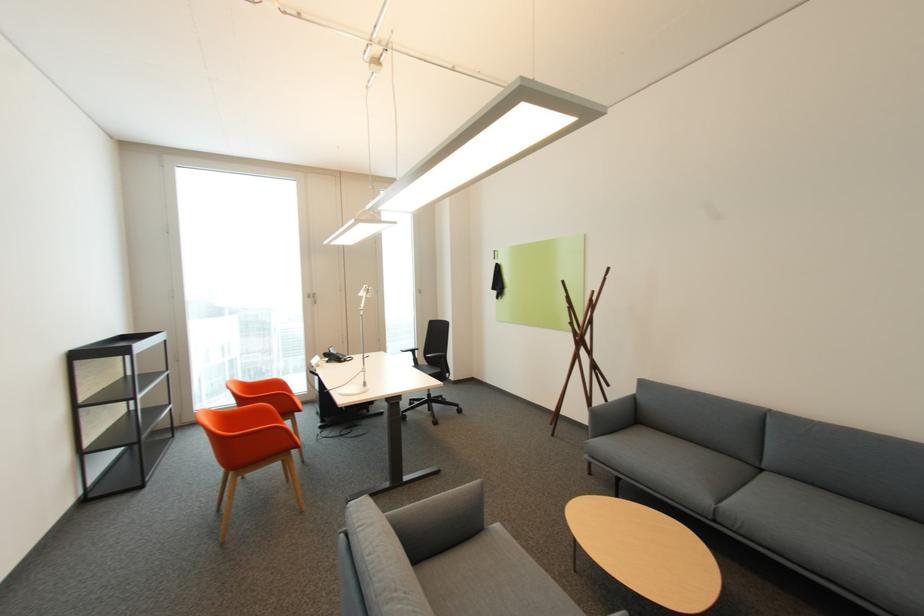
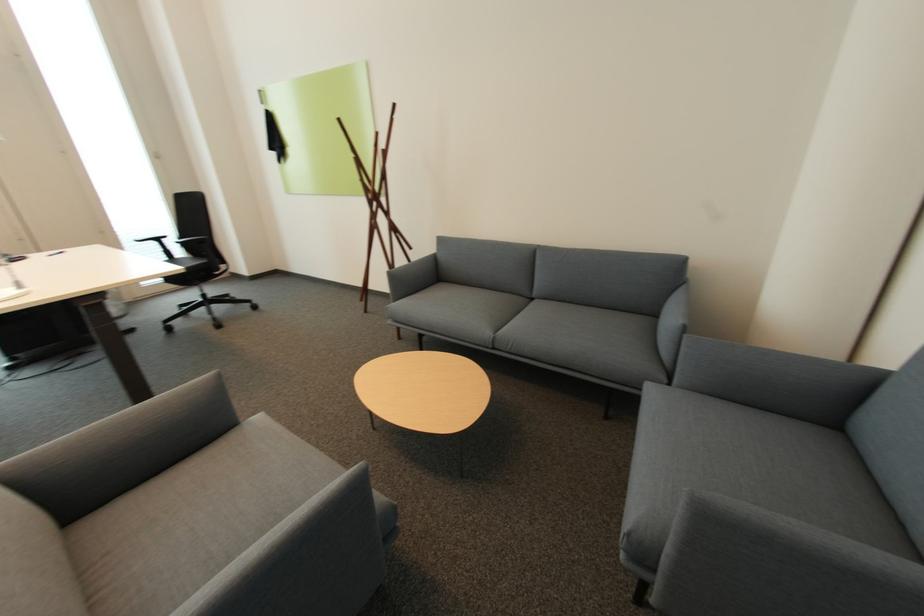
Where in the second image is the point corresponding to [485,482] from the first image?

(219, 373)